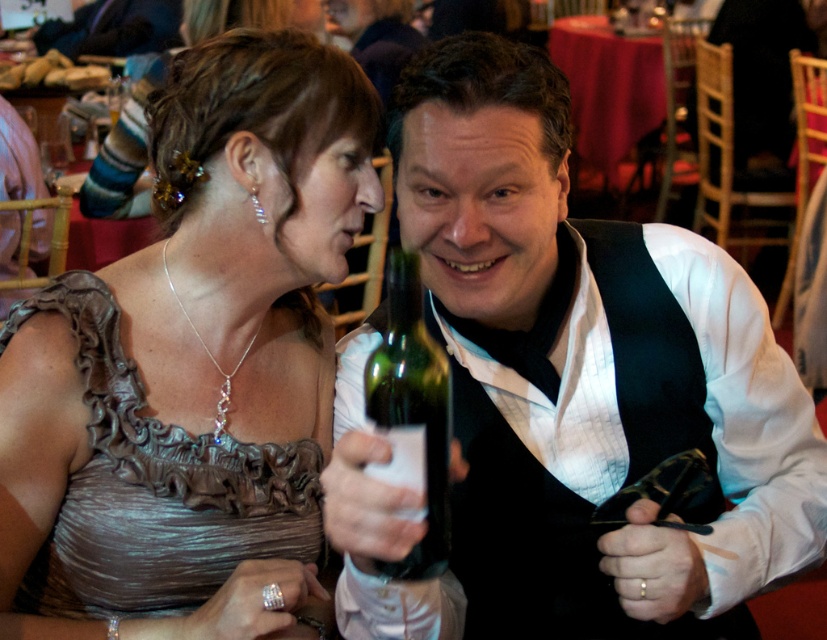
Question: Is shiny silver dress at center bigger than green glass bottle at center?

Choices:
 (A) yes
 (B) no

Answer: (A)

Question: Which object is positioned closest to the green glass bottle at center?

Choices:
 (A) shiny silver dress at center
 (B) matte green glass bottle at center

Answer: (B)

Question: Can you confirm if matte green glass bottle at center is positioned to the right of shiny silver dress at center?

Choices:
 (A) yes
 (B) no

Answer: (A)

Question: Does matte green glass bottle at center have a lesser width compared to green glass bottle at center?

Choices:
 (A) yes
 (B) no

Answer: (B)

Question: Which of the following is the farthest from the observer?

Choices:
 (A) (419, 182)
 (B) (211, 467)
 (C) (376, 380)

Answer: (B)

Question: Which of the following is the farthest from the observer?

Choices:
 (A) (319, 321)
 (B) (613, 468)
 (C) (398, 371)

Answer: (A)